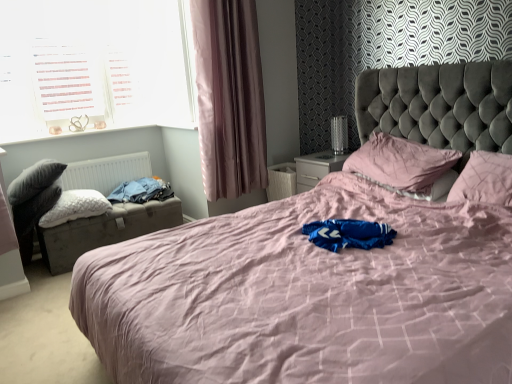
Question: From the image's perspective, is white plastic window at upper left above or below white fluffy pillow at left, which appears as the 1th pillow when viewed from the left?

Choices:
 (A) below
 (B) above

Answer: (B)

Question: From a real-world perspective, is white plastic window at upper left physically located above or below white fluffy pillow at left, which appears as the 1th pillow when viewed from the left?

Choices:
 (A) below
 (B) above

Answer: (B)

Question: Estimate the real-world distances between objects in this image. Which object is closer to the white matte radiator at left?

Choices:
 (A) blue fabric at left
 (B) leatherette storage trunk at left
 (C) pink satin curtain at left
 (D) dark grey fabric swivel chair at left
 (E) pink fabric bed at center

Answer: (A)

Question: Which object is positioned closest to the white matte radiator at left?

Choices:
 (A) leatherette storage trunk at left
 (B) dark grey fabric swivel chair at left
 (C) pink satin curtain at left
 (D) white plastic window at upper left
 (E) pink fabric bed at center

Answer: (A)